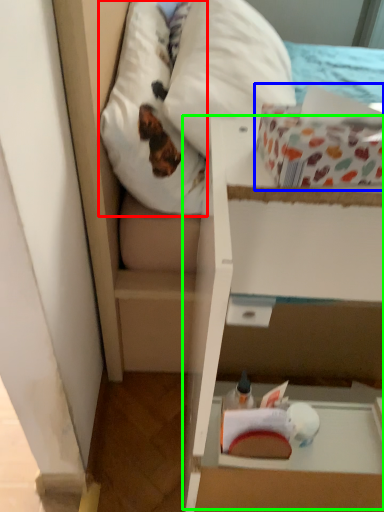
Question: Considering the real-world distances, which object is farthest from pillow (highlighted by a red box)? cardboard box (highlighted by a blue box) or cardboard box (highlighted by a green box)?

Choices:
 (A) cardboard box
 (B) cardboard box

Answer: (A)